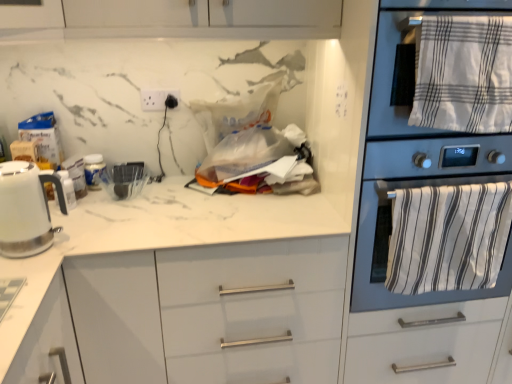
In order to click on metallic oven at right in this screenshot , I will do `click(413, 163)`.

What do you see at coordinates (448, 237) in the screenshot? I see `white striped towel at right, which is counted as the first bath towel, starting from the bottom` at bounding box center [448, 237].

Describe the element at coordinates (26, 209) in the screenshot. This screenshot has width=512, height=384. I see `white glossy electric kettle at left` at that location.

Image resolution: width=512 pixels, height=384 pixels. I want to click on white plastic electric outlet at upper center, so click(156, 98).

Image resolution: width=512 pixels, height=384 pixels. What do you see at coordinates (464, 74) in the screenshot? I see `white striped towel at upper right, the 1th bath towel viewed from the top` at bounding box center [464, 74].

Identify the location of white striped towel at upper right, placed as the 2th bath towel when sorted from bottom to top. pyautogui.click(x=464, y=74).

Where is `white marble countertop at center`? This screenshot has height=384, width=512. white marble countertop at center is located at coordinates (181, 290).

In order to click on bath towel located on the left of white striped towel at upper right, placed as the 2th bath towel when sorted from bottom to top in this screenshot , I will do `click(448, 237)`.

Is white striped towel at upper right, placed as the 2th bath towel when sorted from bottom to top, to the right of white striped towel at right, which appears as the 2th bath towel when viewed from the top, from the viewer's perspective?

Correct, you'll find white striped towel at upper right, placed as the 2th bath towel when sorted from bottom to top, to the right of white striped towel at right, which appears as the 2th bath towel when viewed from the top.

Which object is wider, white striped towel at upper right, the 1th bath towel viewed from the top, or white striped towel at right, which appears as the 2th bath towel when viewed from the top?

white striped towel at upper right, the 1th bath towel viewed from the top.

Is there a large distance between white striped towel at upper right, placed as the 2th bath towel when sorted from bottom to top, and metallic oven at right?

No, white striped towel at upper right, placed as the 2th bath towel when sorted from bottom to top, is not far from metallic oven at right.

Which point is more forward, (x=436, y=22) or (x=431, y=138)?

The point (x=436, y=22) is in front.

Considering the relative sizes of white striped towel at upper right, the 1th bath towel viewed from the top, and metallic oven at right in the image provided, is white striped towel at upper right, the 1th bath towel viewed from the top, taller than metallic oven at right?

No.

Is white striped towel at upper right, the 1th bath towel viewed from the top, wider or thinner than metallic oven at right?

white striped towel at upper right, the 1th bath towel viewed from the top, is thinner than metallic oven at right.

Considering the relative sizes of white plastic electric outlet at upper center and white striped towel at right, which is counted as the first bath towel, starting from the bottom, in the image provided, is white plastic electric outlet at upper center wider than white striped towel at right, which is counted as the first bath towel, starting from the bottom,?

Incorrect, the width of white plastic electric outlet at upper center does not surpass that of white striped towel at right, which is counted as the first bath towel, starting from the bottom.

In the scene shown: Is white plastic electric outlet at upper center oriented away from white striped towel at right, which appears as the 2th bath towel when viewed from the top?

No, white plastic electric outlet at upper center is not facing away from white striped towel at right, which appears as the 2th bath towel when viewed from the top.

Is white plastic electric outlet at upper center placed right next to white striped towel at right, which appears as the 2th bath towel when viewed from the top?

No, white plastic electric outlet at upper center is not next to white striped towel at right, which appears as the 2th bath towel when viewed from the top.

Is white plastic electric outlet at upper center positioned behind white striped towel at right, which is counted as the first bath towel, starting from the bottom?

Yes, white plastic electric outlet at upper center is further from the viewer.

Is white glossy electric kettle at left placed right next to white marble countertop at center?

No, white glossy electric kettle at left is not in contact with white marble countertop at center.

Image resolution: width=512 pixels, height=384 pixels. I want to click on countertop below the white glossy electric kettle at left (from a real-world perspective), so click(181, 290).

In the image, is white glossy electric kettle at left on the left side or the right side of white marble countertop at center?

From the image, it's evident that white glossy electric kettle at left is to the left of white marble countertop at center.

Could you tell me if white glossy electric kettle at left is turned towards white marble countertop at center?

No, white glossy electric kettle at left is not facing towards white marble countertop at center.

From a real-world perspective, who is located higher, white plastic electric outlet at upper center or white glossy electric kettle at left?

In real-world perspective, white plastic electric outlet at upper center is above.

Is white plastic electric outlet at upper center smaller than white glossy electric kettle at left?

Indeed, white plastic electric outlet at upper center has a smaller size compared to white glossy electric kettle at left.

From the image's perspective, is white plastic electric outlet at upper center located above or below white glossy electric kettle at left?

From the image's perspective, white plastic electric outlet at upper center appears above white glossy electric kettle at left.

Considering the sizes of objects white plastic electric outlet at upper center and white glossy electric kettle at left in the image provided, who is thinner, white plastic electric outlet at upper center or white glossy electric kettle at left?

With smaller width is white plastic electric outlet at upper center.

Measure the distance between white marble countertop at center and white striped towel at upper right, the 1th bath towel viewed from the top.

They are 74.63 centimeters apart.

From the image's perspective, which object appears higher, white marble countertop at center or white striped towel at upper right, placed as the 2th bath towel when sorted from bottom to top?

white striped towel at upper right, placed as the 2th bath towel when sorted from bottom to top.

From the picture: Could you tell me if white marble countertop at center is facing white striped towel at upper right, the 1th bath towel viewed from the top?

No, white marble countertop at center is not facing towards white striped towel at upper right, the 1th bath towel viewed from the top.

Based on the photo, considering the relative sizes of white marble countertop at center and white striped towel at upper right, the 1th bath towel viewed from the top, in the image provided, is white marble countertop at center wider than white striped towel at upper right, the 1th bath towel viewed from the top,?

Yes, white marble countertop at center is wider than white striped towel at upper right, the 1th bath towel viewed from the top.

Which object is further away from the camera taking this photo, white glossy electric kettle at left or white plastic electric outlet at upper center?

white plastic electric outlet at upper center is behind.

Between white glossy electric kettle at left and white plastic electric outlet at upper center, which one has less height?

Standing shorter between the two is white plastic electric outlet at upper center.

Could you tell me if white glossy electric kettle at left is turned towards white plastic electric outlet at upper center?

No, white glossy electric kettle at left does not turn towards white plastic electric outlet at upper center.

Who is bigger, white glossy electric kettle at left or white plastic electric outlet at upper center?

Bigger between the two is white glossy electric kettle at left.

Image resolution: width=512 pixels, height=384 pixels. Identify the location of bath towel that appears below the white striped towel at upper right, placed as the 2th bath towel when sorted from bottom to top (from the image's perspective). (448, 237).

This screenshot has height=384, width=512. I want to click on bath towel above the metallic oven at right (from a real-world perspective), so click(x=464, y=74).

Consider the image. Considering their positions, is white striped towel at upper right, the 1th bath towel viewed from the top, positioned further to white striped towel at right, which is counted as the first bath towel, starting from the bottom, than metallic oven at right?

Based on the image, white striped towel at upper right, the 1th bath towel viewed from the top, appears to be further to white striped towel at right, which is counted as the first bath towel, starting from the bottom.

Looking at the image, which one is located closer to white marble countertop at center, white striped towel at right, which is counted as the first bath towel, starting from the bottom, or metallic oven at right?

metallic oven at right is positioned closer to the anchor white marble countertop at center.

Considering their positions, is metallic oven at right positioned further to white plastic electric outlet at upper center than white glossy electric kettle at left?

metallic oven at right is positioned further to the anchor white plastic electric outlet at upper center.

From the image, which object appears to be nearer to white striped towel at upper right, the 1th bath towel viewed from the top, metallic oven at right or white glossy electric kettle at left?

metallic oven at right lies closer to white striped towel at upper right, the 1th bath towel viewed from the top, than the other object.

Looking at this image, when comparing their distances from metallic oven at right, does white marble countertop at center or white striped towel at upper right, the 1th bath towel viewed from the top, seem further?

The object further to metallic oven at right is white marble countertop at center.

From the image, which object appears to be nearer to white marble countertop at center, white striped towel at upper right, the 1th bath towel viewed from the top, or white glossy electric kettle at left?

The object closer to white marble countertop at center is white glossy electric kettle at left.

Estimate the real-world distances between objects in this image. Which object is further from white glossy electric kettle at left, white striped towel at upper right, placed as the 2th bath towel when sorted from bottom to top, or white striped towel at right, which appears as the 2th bath towel when viewed from the top?

white striped towel at upper right, placed as the 2th bath towel when sorted from bottom to top.

Considering their positions, is white striped towel at upper right, placed as the 2th bath towel when sorted from bottom to top, positioned further to metallic oven at right than white glossy electric kettle at left?

white glossy electric kettle at left is positioned further to the anchor metallic oven at right.

This screenshot has height=384, width=512. I want to click on electric outlet between white marble countertop at center and white striped towel at upper right, placed as the 2th bath towel when sorted from bottom to top, in the horizontal direction, so click(x=156, y=98).

Find the location of a particular element. The height and width of the screenshot is (384, 512). electric outlet located between white marble countertop at center and metallic oven at right in the left-right direction is located at coordinates (156, 98).

Where is `home appliance between white glossy electric kettle at left and white striped towel at upper right, the 1th bath towel viewed from the top`? home appliance between white glossy electric kettle at left and white striped towel at upper right, the 1th bath towel viewed from the top is located at coordinates (413, 163).

Identify the location of home appliance between white plastic electric outlet at upper center and white striped towel at upper right, placed as the 2th bath towel when sorted from bottom to top, from left to right. Image resolution: width=512 pixels, height=384 pixels. (413, 163).